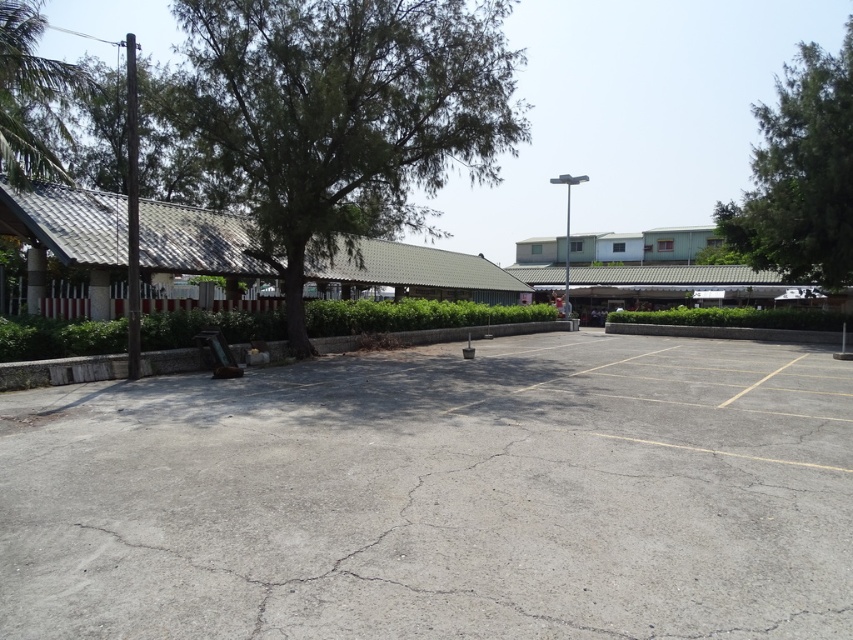
Where is `green leafy tree at upper right`? green leafy tree at upper right is located at coordinates (799, 173).

You are a GUI agent. You are given a task and a screenshot of the screen. Output one action in this format:
    pyautogui.click(x=<x>, y=<y>)
    Task: Click on the green leafy tree at upper right
    The height and width of the screenshot is (640, 853).
    Given the screenshot: What is the action you would take?
    pyautogui.click(x=799, y=173)

Identify the location of green leafy tree at upper right. The height and width of the screenshot is (640, 853). (799, 173).

What do you see at coordinates (439, 497) in the screenshot? Image resolution: width=853 pixels, height=640 pixels. I see `gray asphalt parking lot at center` at bounding box center [439, 497].

Who is positioned more to the right, gray asphalt parking lot at center or green leafy tree at upper right?

From the viewer's perspective, green leafy tree at upper right appears more on the right side.

You are a GUI agent. You are given a task and a screenshot of the screen. Output one action in this format:
    pyautogui.click(x=<x>, y=<y>)
    Task: Click on the gray asphalt parking lot at center
    The image size is (853, 640).
    Given the screenshot: What is the action you would take?
    pyautogui.click(x=439, y=497)

Identify the location of gray asphalt parking lot at center. Image resolution: width=853 pixels, height=640 pixels. (439, 497).

Can you confirm if gray asphalt parking lot at center is taller than green leafy tree at upper left?

No, gray asphalt parking lot at center is not taller than green leafy tree at upper left.

Identify the location of gray asphalt parking lot at center. The image size is (853, 640). (439, 497).

Where is `gray asphalt parking lot at center`? gray asphalt parking lot at center is located at coordinates (439, 497).